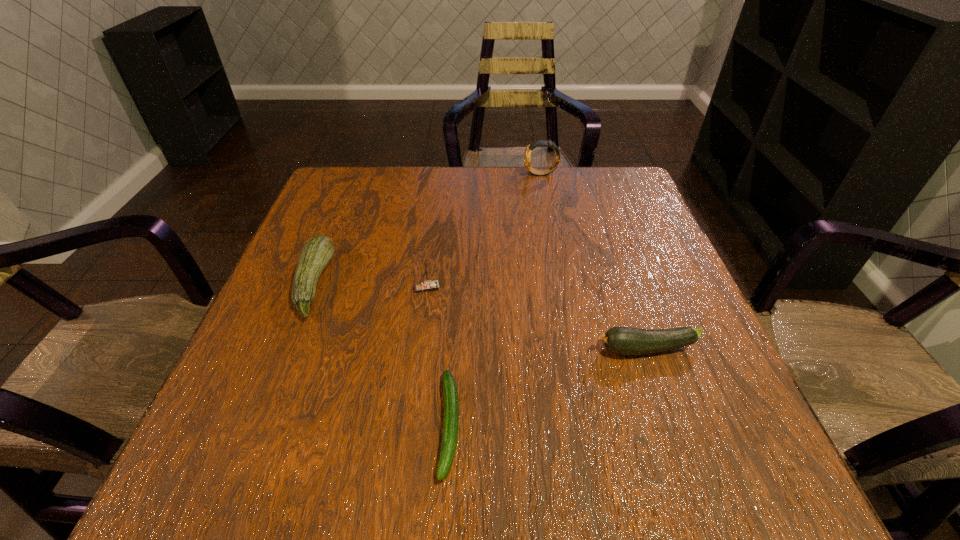
The height and width of the screenshot is (540, 960). Identify the location of free space at the far edge. (534, 197).

Where is `free space at the near edge of the desktop`? free space at the near edge of the desktop is located at coordinates (557, 444).

In the image, there is a desktop. What are the coordinates of `free region at the left edge` in the screenshot? It's located at (242, 355).

This screenshot has height=540, width=960. What are the coordinates of `vacant point at the right edge` in the screenshot? It's located at (720, 436).

Identify the location of free space at the far left corner of the desktop. (351, 178).

The image size is (960, 540). In order to click on free space at the near left corner of the desktop in this screenshot , I will do `click(224, 467)`.

Locate an element on the screen. free space at the far right corner of the desktop is located at coordinates (617, 191).

I want to click on vacant area that lies between the farthest object and the rightmost zucchini, so click(593, 261).

Locate an element on the screen. free spot between the watch and the rightmost zucchini is located at coordinates click(593, 261).

This screenshot has height=540, width=960. I want to click on free area in between the matchbox and the second farthest zucchini, so click(x=537, y=318).